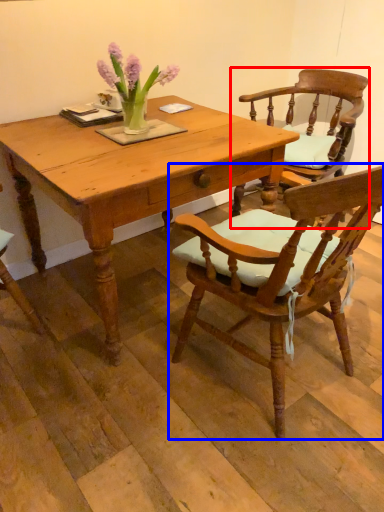
Question: Which of the following is the closest to the observer, chair (highlighted by a red box) or chair (highlighted by a blue box)?

Choices:
 (A) chair
 (B) chair

Answer: (B)